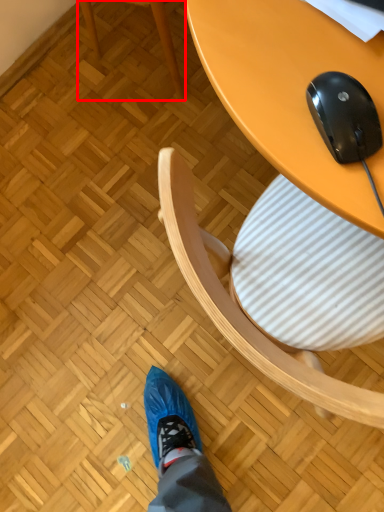
Question: Observing the image, what is the correct spatial positioning of chair (annotated by the red box) in reference to mouse?

Choices:
 (A) right
 (B) left

Answer: (B)